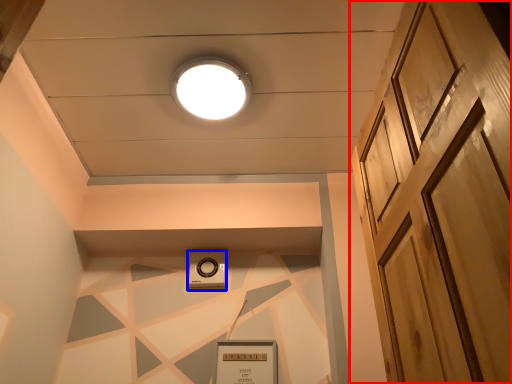
Question: Which of the following is the farthest to the observer, door (highlighted by a red box) or thermostat (highlighted by a blue box)?

Choices:
 (A) door
 (B) thermostat

Answer: (B)